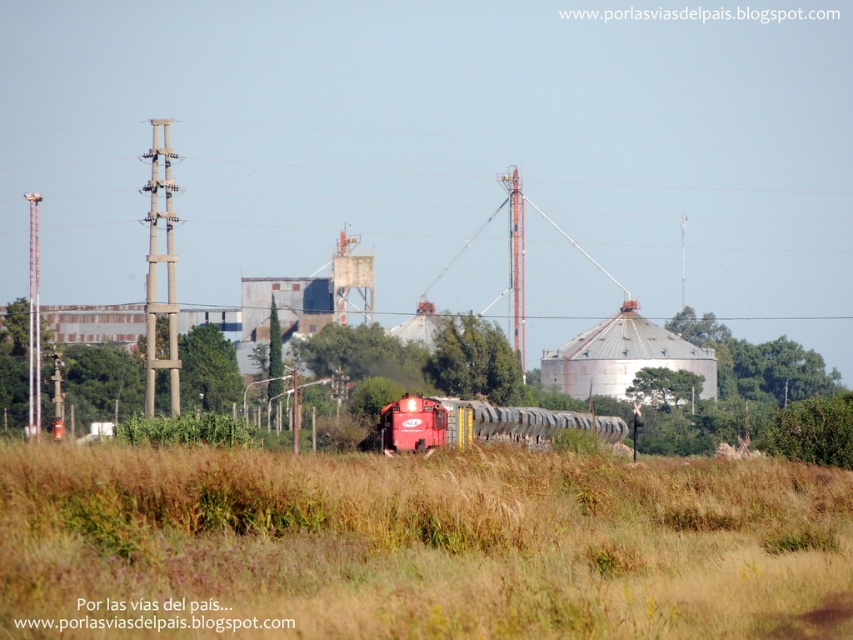
Between brown grassy field at center and matte red train at center, which one has less height?

A: Standing shorter between the two is matte red train at center.

Is point (351, 593) positioned behind point (546, 438)?

No, (351, 593) is closer to viewer.

Is point (425, 573) more distant than point (422, 417)?

No, it is not.

Image resolution: width=853 pixels, height=640 pixels. I want to click on brown grassy field at center, so click(416, 545).